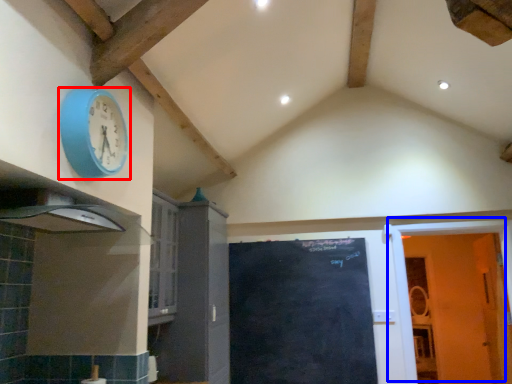
Question: Which object is closer to the camera taking this photo, wall clock (highlighted by a red box) or door (highlighted by a blue box)?

Choices:
 (A) wall clock
 (B) door

Answer: (A)